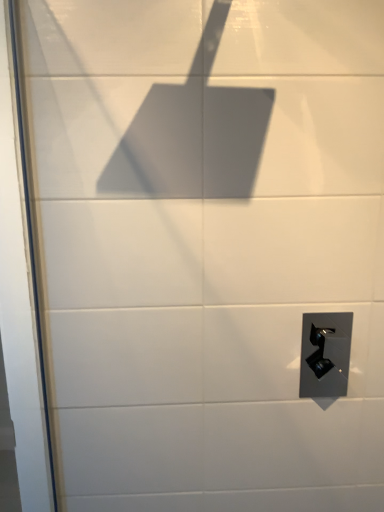
What do you see at coordinates (21, 290) in the screenshot? I see `transparent glass screen door at left` at bounding box center [21, 290].

Locate an element on the screen. transparent glass screen door at left is located at coordinates (21, 290).

What is the approximate height of transparent glass screen door at left?

1.19 meters.

Measure the distance between point (307, 328) and camera.

Point (307, 328) and camera are 4.45 feet apart.

This screenshot has width=384, height=512. Describe the element at coordinates (325, 354) in the screenshot. I see `satin black door handle at lower right` at that location.

Where is `satin black door handle at lower right`? Image resolution: width=384 pixels, height=512 pixels. satin black door handle at lower right is located at coordinates [325, 354].

What are the coordinates of `transparent glass screen door at left` in the screenshot? It's located at (21, 290).

Which object is positioned more to the left, satin black door handle at lower right or transparent glass screen door at left?

transparent glass screen door at left is more to the left.

Looking at this image, does satin black door handle at lower right come in front of transparent glass screen door at left?

No, it is behind transparent glass screen door at left.

Which is further, (329, 317) or (19, 486)?

Point (329, 317)

From the image's perspective, would you say satin black door handle at lower right is positioned over transparent glass screen door at left?

No.

From a real-world perspective, between satin black door handle at lower right and transparent glass screen door at left, who is vertically higher?

In real-world perspective, transparent glass screen door at left is above.

Considering the sizes of satin black door handle at lower right and transparent glass screen door at left in the image, is satin black door handle at lower right wider or thinner than transparent glass screen door at left?

Considering their sizes, satin black door handle at lower right looks slimmer than transparent glass screen door at left.

Does satin black door handle at lower right have a greater height compared to transparent glass screen door at left?

No, satin black door handle at lower right is not taller than transparent glass screen door at left.

Is satin black door handle at lower right smaller than transparent glass screen door at left?

Yes, satin black door handle at lower right is smaller than transparent glass screen door at left.

Can transparent glass screen door at left be found inside satin black door handle at lower right?

No, transparent glass screen door at left is not inside satin black door handle at lower right.

Is satin black door handle at lower right placed right next to transparent glass screen door at left?

They are not placed beside each other.

Could you tell me if satin black door handle at lower right is facing transparent glass screen door at left?

No.

How much distance is there between satin black door handle at lower right and transparent glass screen door at left?

34.96 inches.

You are a GUI agent. You are given a task and a screenshot of the screen. Output one action in this format:
    pyautogui.click(x=<x>, y=<y>)
    Task: Click on the door handle behind the transparent glass screen door at left
    
    Given the screenshot: What is the action you would take?
    pyautogui.click(x=325, y=354)

Which is more to the left, transparent glass screen door at left or satin black door handle at lower right?

transparent glass screen door at left.

In the image, is transparent glass screen door at left positioned in front of or behind satin black door handle at lower right?

transparent glass screen door at left is in front of satin black door handle at lower right.

Considering the points (35, 382) and (304, 366), which point is behind, point (35, 382) or point (304, 366)?

The point (304, 366) is behind.

From the image's perspective, would you say transparent glass screen door at left is positioned over satin black door handle at lower right?

Yes, from the image's perspective, transparent glass screen door at left is above satin black door handle at lower right.

Based on the photo, from a real-world perspective, is transparent glass screen door at left positioned over satin black door handle at lower right based on gravity?

Yes.

Looking at their sizes, would you say transparent glass screen door at left is wider or thinner than satin black door handle at lower right?

transparent glass screen door at left is wider than satin black door handle at lower right.

Does transparent glass screen door at left have a lesser height compared to satin black door handle at lower right?

In fact, transparent glass screen door at left may be taller than satin black door handle at lower right.

Which of these two, transparent glass screen door at left or satin black door handle at lower right, is bigger?

transparent glass screen door at left.

Is transparent glass screen door at left not inside satin black door handle at lower right?

transparent glass screen door at left is positioned outside satin black door handle at lower right.

Is the surface of transparent glass screen door at left in direct contact with satin black door handle at lower right?

transparent glass screen door at left is not next to satin black door handle at lower right, and they're not touching.

Is transparent glass screen door at left oriented towards satin black door handle at lower right?

No, transparent glass screen door at left is not turned towards satin black door handle at lower right.

Can you tell me how much transparent glass screen door at left and satin black door handle at lower right differ in facing direction?

The angle between the facing direction of transparent glass screen door at left and the facing direction of satin black door handle at lower right is 89.4 degrees.

Where is `door handle located behind the transparent glass screen door at left`? The width and height of the screenshot is (384, 512). door handle located behind the transparent glass screen door at left is located at coordinates (325, 354).

Image resolution: width=384 pixels, height=512 pixels. I want to click on screen door in front of the satin black door handle at lower right, so [21, 290].

At what (x,y) coordinates should I click in order to perform the action: click on screen door above the satin black door handle at lower right (from the image's perspective). Please return your answer as a coordinate pair (x, y). This screenshot has width=384, height=512. Looking at the image, I should click on (21, 290).